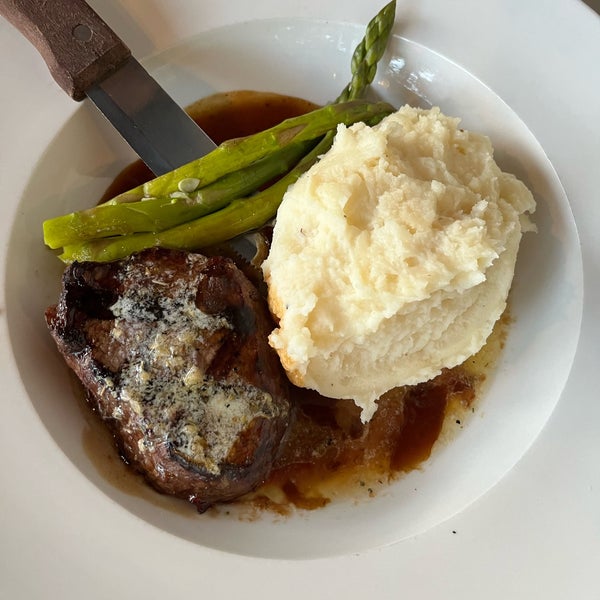
Identify the location of white background, countertop. (561, 64).